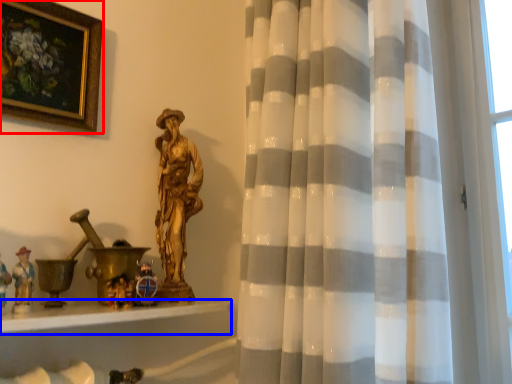
Question: Among these objects, which one is nearest to the camera, picture frame (highlighted by a red box) or window sill (highlighted by a blue box)?

Choices:
 (A) picture frame
 (B) window sill

Answer: (B)